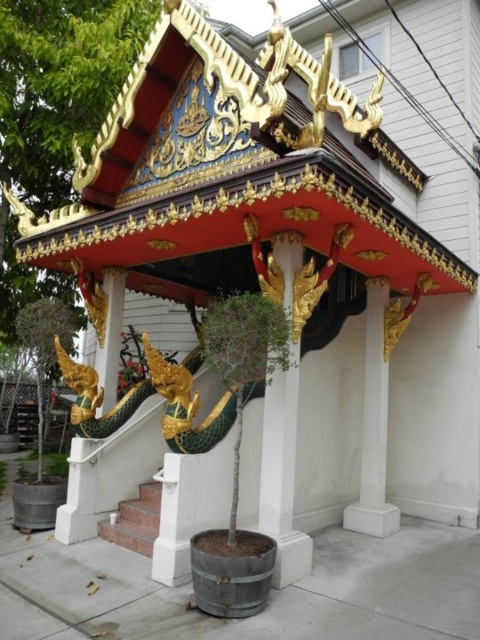
Can you confirm if white glossy pillar at center is shorter than white marble pillar at center?

Yes, white glossy pillar at center is shorter than white marble pillar at center.

Describe the element at coordinates (282, 476) in the screenshot. The width and height of the screenshot is (480, 640). I see `white glossy pillar at center` at that location.

What do you see at coordinates (282, 476) in the screenshot? The width and height of the screenshot is (480, 640). I see `white glossy pillar at center` at bounding box center [282, 476].

Where is `white glossy pillar at center`? white glossy pillar at center is located at coordinates (282, 476).

Can you confirm if marble stairs at lower center is positioned below gold metallic dragon at center?

Indeed, marble stairs at lower center is positioned under gold metallic dragon at center.

Is point (156, 513) closer to viewer compared to point (105, 296)?

Yes, it is.

Which is in front, point (132, 550) or point (105, 342)?

Positioned in front is point (132, 550).

At what (x,y) coordinates should I click in order to perform the action: click on marble stairs at lower center. Please return your answer as a coordinate pair (x, y). Looking at the image, I should click on (134, 520).

Can you confirm if white marble pillar at center is positioned below marble stairs at lower center?

No.

Measure the distance between white marble pillar at center and camera.

They are 22.35 feet apart.

The width and height of the screenshot is (480, 640). What are the coordinates of `white marble pillar at center` in the screenshot? It's located at coord(373,426).